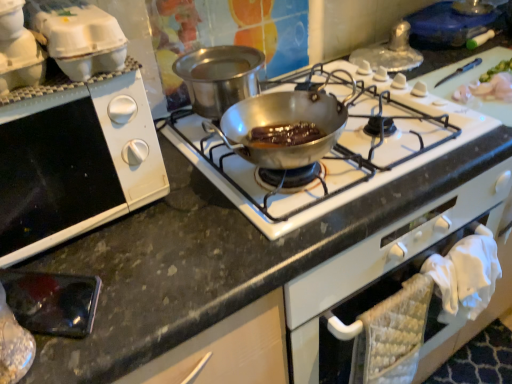
Question: From a real-world perspective, is white matte oven at left physically located above or below stainless steel pan at center?

Choices:
 (A) above
 (B) below

Answer: (A)

Question: Considering their positions, is white matte oven at left located in front of or behind stainless steel pan at center?

Choices:
 (A) front
 (B) behind

Answer: (A)

Question: Which is nearer to the white cardboard egg carton at upper left?

Choices:
 (A) shiny silver pan at center
 (B) white matte oven at left
 (C) white plastic egg carton at upper left
 (D) stainless steel pan at center

Answer: (C)

Question: Based on their relative distances, which object is nearer to the white matte oven at left?

Choices:
 (A) white cardboard egg carton at upper left
 (B) stainless steel pan at center
 (C) shiny silver pan at center
 (D) white plastic egg carton at upper left

Answer: (A)